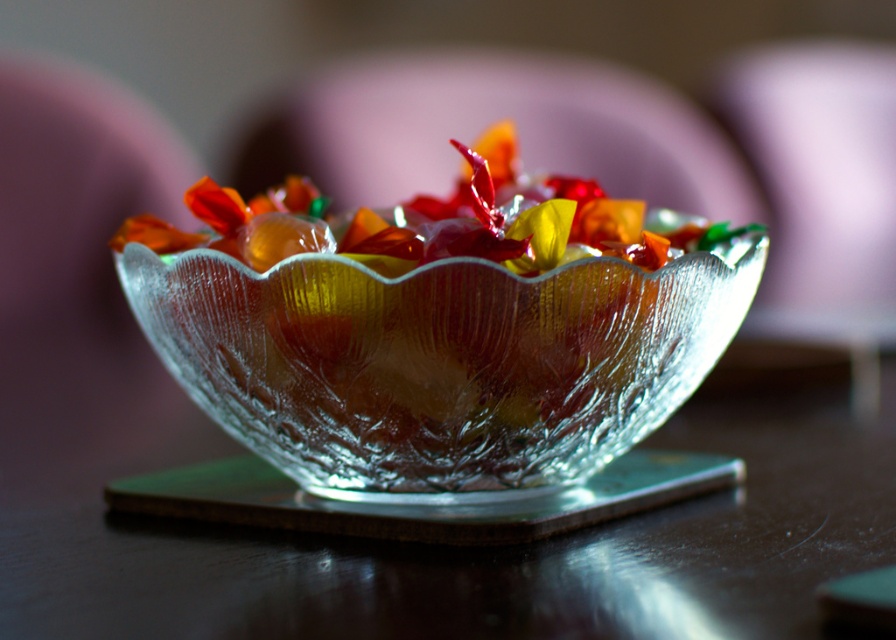
Question: Considering the relative positions of transparent glass bowl at center and transparent textured glass bowl at center in the image provided, where is transparent glass bowl at center located with respect to transparent textured glass bowl at center?

Choices:
 (A) right
 (B) left

Answer: (A)

Question: Which of these objects is positioned farthest from the transparent glass bowl at center?

Choices:
 (A) translucent glass bowl at center
 (B) transparent textured glass bowl at center

Answer: (A)

Question: Is translucent glass bowl at center positioned before transparent glass plate at center?

Choices:
 (A) no
 (B) yes

Answer: (B)

Question: Estimate the real-world distances between objects in this image. Which object is farther from the transparent glass bowl at center?

Choices:
 (A) transparent glass plate at center
 (B) translucent glass bowl at center
 (C) transparent textured glass bowl at center

Answer: (B)

Question: Is transparent glass bowl at center bigger than transparent textured glass bowl at center?

Choices:
 (A) yes
 (B) no

Answer: (A)

Question: Among these points, which one is nearest to the camera?

Choices:
 (A) (808, 416)
 (B) (592, 280)
 (C) (550, 212)
 (D) (142, 476)

Answer: (B)